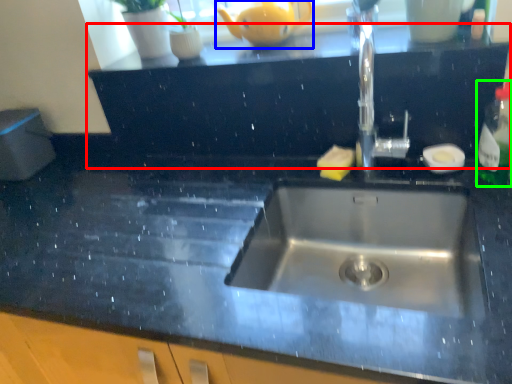
Question: Which is farther away from dresser (highlighted by a red box)? tea pot (highlighted by a blue box) or bottle (highlighted by a green box)?

Choices:
 (A) tea pot
 (B) bottle

Answer: (B)